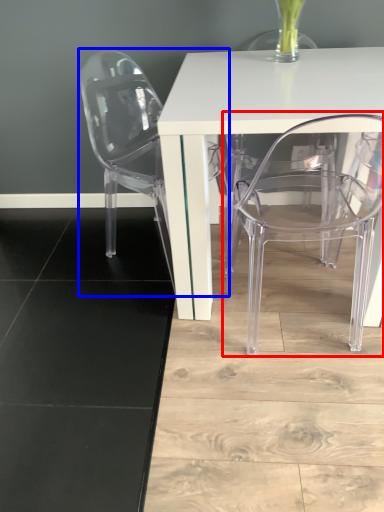
Question: Among these objects, which one is nearest to the camera, chair (highlighted by a red box) or chair (highlighted by a blue box)?

Choices:
 (A) chair
 (B) chair

Answer: (A)